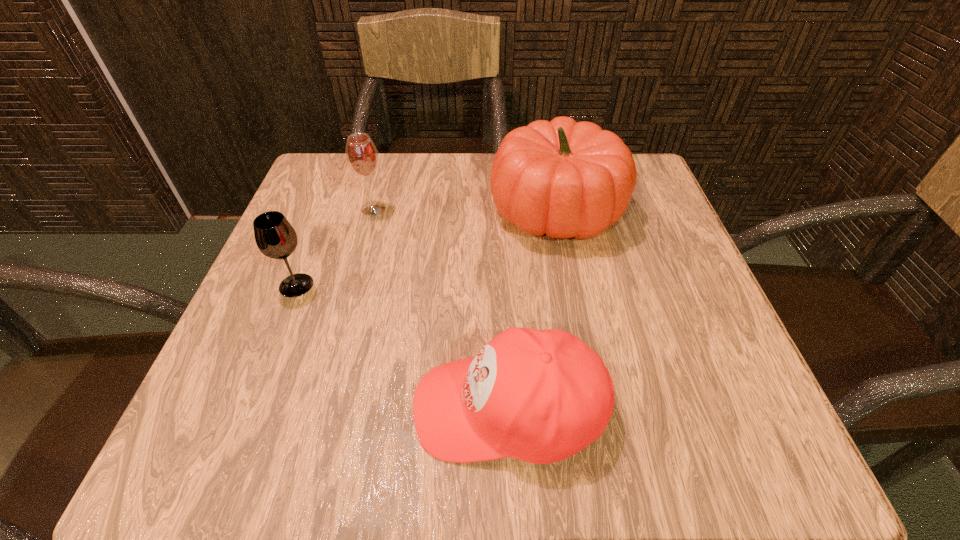
At what (x,y) coordinates should I click in order to perform the action: click on free space at the left edge. Please return your answer as a coordinate pair (x, y). Image resolution: width=960 pixels, height=540 pixels. Looking at the image, I should click on (303, 262).

This screenshot has height=540, width=960. In the image, there is a desktop. Identify the location of blank space at the right edge. (663, 220).

Identify the location of vacant region at the far left corner of the desktop. (315, 183).

At what (x,y) coordinates should I click in order to perform the action: click on vacant area at the far right corner. Please return your answer as a coordinate pair (x, y). The width and height of the screenshot is (960, 540). Looking at the image, I should click on (639, 180).

Locate an element on the screen. The height and width of the screenshot is (540, 960). vacant area at the near right corner of the desktop is located at coordinates (731, 468).

You are a GUI agent. You are given a task and a screenshot of the screen. Output one action in this format:
    pyautogui.click(x=<x>, y=<y>)
    Task: Click on the blank region between the leftmost object and the pumpkin
    
    Given the screenshot: What is the action you would take?
    pyautogui.click(x=426, y=248)

Where is `vacant space that is in between the pumpkin and the nearer wineglass`? vacant space that is in between the pumpkin and the nearer wineglass is located at coordinates (426, 248).

Locate an element on the screen. This screenshot has width=960, height=540. vacant space that is in between the nearest object and the farther wineglass is located at coordinates (441, 308).

Find the location of `free spot between the right wineglass and the baseball cap`. free spot between the right wineglass and the baseball cap is located at coordinates (441, 308).

Where is `free space between the nearest object and the farther wineglass`? free space between the nearest object and the farther wineglass is located at coordinates (441, 308).